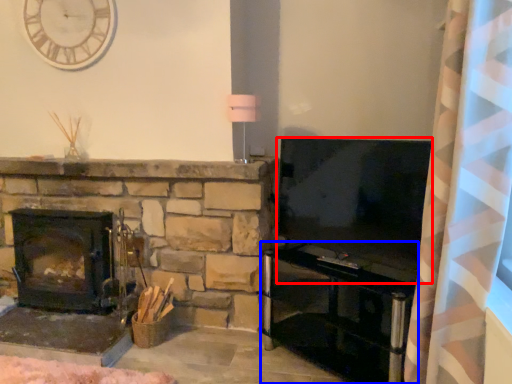
Question: Which of the following is the closest to the observer, television (highlighted by a red box) or entertainment center (highlighted by a blue box)?

Choices:
 (A) television
 (B) entertainment center

Answer: (B)